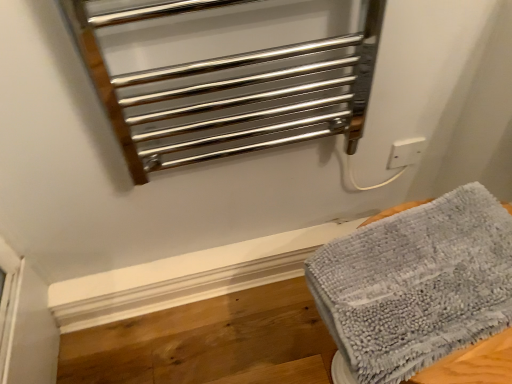
Question: Is white plastic electric outlet at upper right in front of or behind polished metal towel rack at upper center in the image?

Choices:
 (A) behind
 (B) front

Answer: (A)

Question: From a real-world perspective, is white plastic electric outlet at upper right physically located above or below polished metal towel rack at upper center?

Choices:
 (A) below
 (B) above

Answer: (A)

Question: Which object is the closest to the white plastic electric outlet at upper right?

Choices:
 (A) gray fluffy towel at lower right
 (B) polished metal towel rack at upper center

Answer: (B)

Question: Based on their relative distances, which object is nearer to the white plastic electric outlet at upper right?

Choices:
 (A) polished metal towel rack at upper center
 (B) gray fluffy towel at lower right

Answer: (A)